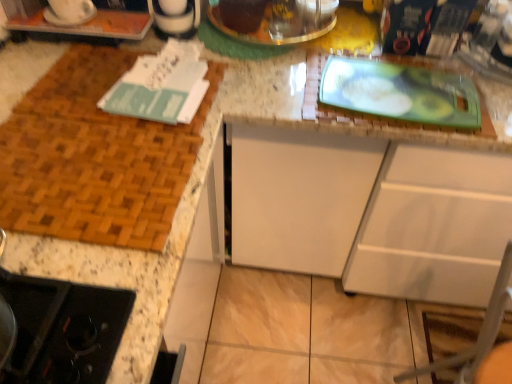
At what (x,y) coordinates should I click in order to perform the action: click on white matte cabinet at center. Please return your answer as a coordinate pair (x, y). This screenshot has width=512, height=384. Looking at the image, I should click on (372, 213).

Considering the sizes of objects metallic silver pot at upper center, placed as the 1th appliance when sorted from back to front, and white matte cabinet at center in the image provided, who is smaller, metallic silver pot at upper center, placed as the 1th appliance when sorted from back to front, or white matte cabinet at center?

Smaller between the two is metallic silver pot at upper center, placed as the 1th appliance when sorted from back to front.

Would you say metallic silver pot at upper center, placed as the 1th appliance when sorted from back to front, is to the left or to the right of white matte cabinet at center in the picture?

In the image, metallic silver pot at upper center, placed as the 1th appliance when sorted from back to front, appears on the left side of white matte cabinet at center.

From the image's perspective, which one is positioned lower, metallic silver pot at upper center, placed as the 1th appliance when sorted from back to front, or white matte cabinet at center?

white matte cabinet at center, from the image's perspective.

Considering the points (470, 211) and (46, 9), which point is in front, point (470, 211) or point (46, 9)?

The point (46, 9) is closer.

Would you say white matte cabinet at center is inside or outside white glossy coffee maker at upper left, acting as the 1th appliance starting from the left?

white matte cabinet at center is outside white glossy coffee maker at upper left, acting as the 1th appliance starting from the left.

Looking at this image, would you say white matte cabinet at center is a long distance from white glossy coffee maker at upper left, placed as the 2th appliance when sorted from back to front?

No, white matte cabinet at center is in close proximity to white glossy coffee maker at upper left, placed as the 2th appliance when sorted from back to front.

Does white matte cabinet at center turn towards white glossy coffee maker at upper left, the 2th appliance positioned from the right?

No.

Does point (393, 291) lie behind point (285, 31)?

Yes, point (393, 291) is behind point (285, 31).

Are white matte cabinet at center and metallic silver pot at upper center, placed as the 1th appliance when sorted from back to front, making contact?

No.

Does white matte cabinet at center have a lesser height compared to metallic silver pot at upper center, which appears as the 2th appliance when viewed from the front?

No.

From the image's perspective, would you say white matte cabinet at center is shown under metallic silver pot at upper center, placed as the 1th appliance when sorted from back to front?

Indeed, from the image's perspective, white matte cabinet at center is shown beneath metallic silver pot at upper center, placed as the 1th appliance when sorted from back to front.

Is point (67, 24) in front of point (407, 207)?

Yes, it is.

Is white glossy coffee maker at upper left, placed as the first appliance when sorted from front to back, placed right next to white matte cabinet at center?

white glossy coffee maker at upper left, placed as the first appliance when sorted from front to back, is not next to white matte cabinet at center, and they're not touching.

Between white glossy coffee maker at upper left, acting as the 1th appliance starting from the left, and white matte cabinet at center, which one has more height?

With more height is white matte cabinet at center.

Which object is further away from the camera, white glossy coffee maker at upper left, acting as the 1th appliance starting from the left, or white matte cabinet at center?

white glossy coffee maker at upper left, acting as the 1th appliance starting from the left, is further away from the camera.

The height and width of the screenshot is (384, 512). Identify the location of appliance on the left side of metallic silver pot at upper center, the 1th appliance in the right-to-left sequence. (69, 12).

Is white glossy coffee maker at upper left, placed as the first appliance when sorted from front to back, next to metallic silver pot at upper center, the 1th appliance in the right-to-left sequence?

No, white glossy coffee maker at upper left, placed as the first appliance when sorted from front to back, is not next to metallic silver pot at upper center, the 1th appliance in the right-to-left sequence.

Can you confirm if white glossy coffee maker at upper left, acting as the 1th appliance starting from the left, is bigger than metallic silver pot at upper center, arranged as the second appliance when viewed from the left?

No.

Is metallic silver pot at upper center, the 1th appliance in the right-to-left sequence, not close to white glossy coffee maker at upper left, the 2th appliance positioned from the right?

metallic silver pot at upper center, the 1th appliance in the right-to-left sequence, is actually quite close to white glossy coffee maker at upper left, the 2th appliance positioned from the right.

Can you confirm if metallic silver pot at upper center, arranged as the second appliance when viewed from the left, is thinner than white glossy coffee maker at upper left, the 2th appliance positioned from the right?

No, metallic silver pot at upper center, arranged as the second appliance when viewed from the left, is not thinner than white glossy coffee maker at upper left, the 2th appliance positioned from the right.

Is metallic silver pot at upper center, placed as the 1th appliance when sorted from back to front, at the right side of white glossy coffee maker at upper left, placed as the 2th appliance when sorted from back to front?

Correct, you'll find metallic silver pot at upper center, placed as the 1th appliance when sorted from back to front, to the right of white glossy coffee maker at upper left, placed as the 2th appliance when sorted from back to front.

Image resolution: width=512 pixels, height=384 pixels. In order to click on appliance directly beneath the white glossy coffee maker at upper left, placed as the 2th appliance when sorted from back to front (from a real-world perspective) in this screenshot , I will do `click(269, 21)`.

You are a GUI agent. You are given a task and a screenshot of the screen. Output one action in this format:
    pyautogui.click(x=<x>, y=<y>)
    Task: Click on the cabinetry on the right of metallic silver pot at upper center, the 1th appliance in the right-to-left sequence
    
    Given the screenshot: What is the action you would take?
    point(372,213)

The image size is (512, 384). I want to click on appliance that is the 1st one when counting upward from the white matte cabinet at center (from the image's perspective), so click(69, 12).

Which object lies further to the anchor point white glossy coffee maker at upper left, acting as the 1th appliance starting from the left, white matte cabinet at center or metallic silver pot at upper center, arranged as the second appliance when viewed from the left?

The object further to white glossy coffee maker at upper left, acting as the 1th appliance starting from the left, is white matte cabinet at center.

Estimate the real-world distances between objects in this image. Which object is further from white glossy coffee maker at upper left, placed as the 2th appliance when sorted from back to front, metallic silver pot at upper center, arranged as the second appliance when viewed from the left, or white matte cabinet at center?

white matte cabinet at center.

Estimate the real-world distances between objects in this image. Which object is closer to white matte cabinet at center, white glossy coffee maker at upper left, placed as the 2th appliance when sorted from back to front, or metallic silver pot at upper center, which appears as the 2th appliance when viewed from the front?

metallic silver pot at upper center, which appears as the 2th appliance when viewed from the front, lies closer to white matte cabinet at center than the other object.

When comparing their distances from white matte cabinet at center, does metallic silver pot at upper center, placed as the 1th appliance when sorted from back to front, or white glossy coffee maker at upper left, placed as the 2th appliance when sorted from back to front, seem further?

white glossy coffee maker at upper left, placed as the 2th appliance when sorted from back to front, is positioned further to the anchor white matte cabinet at center.

Which object lies further to the anchor point metallic silver pot at upper center, arranged as the second appliance when viewed from the left, white matte cabinet at center or white glossy coffee maker at upper left, placed as the 2th appliance when sorted from back to front?

The object further to metallic silver pot at upper center, arranged as the second appliance when viewed from the left, is white matte cabinet at center.

Which object lies further to the anchor point metallic silver pot at upper center, which appears as the 2th appliance when viewed from the front, white glossy coffee maker at upper left, the 2th appliance positioned from the right, or white matte cabinet at center?

Based on the image, white matte cabinet at center appears to be further to metallic silver pot at upper center, which appears as the 2th appliance when viewed from the front.

Where is `appliance located between white glossy coffee maker at upper left, acting as the 1th appliance starting from the left, and white matte cabinet at center in the left-right direction`? This screenshot has height=384, width=512. appliance located between white glossy coffee maker at upper left, acting as the 1th appliance starting from the left, and white matte cabinet at center in the left-right direction is located at coordinates (269, 21).